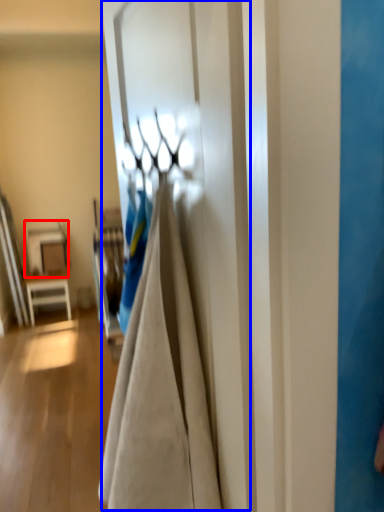
Question: Which object is closer to the camera taking this photo, table (highlighted by a red box) or door (highlighted by a blue box)?

Choices:
 (A) table
 (B) door

Answer: (B)